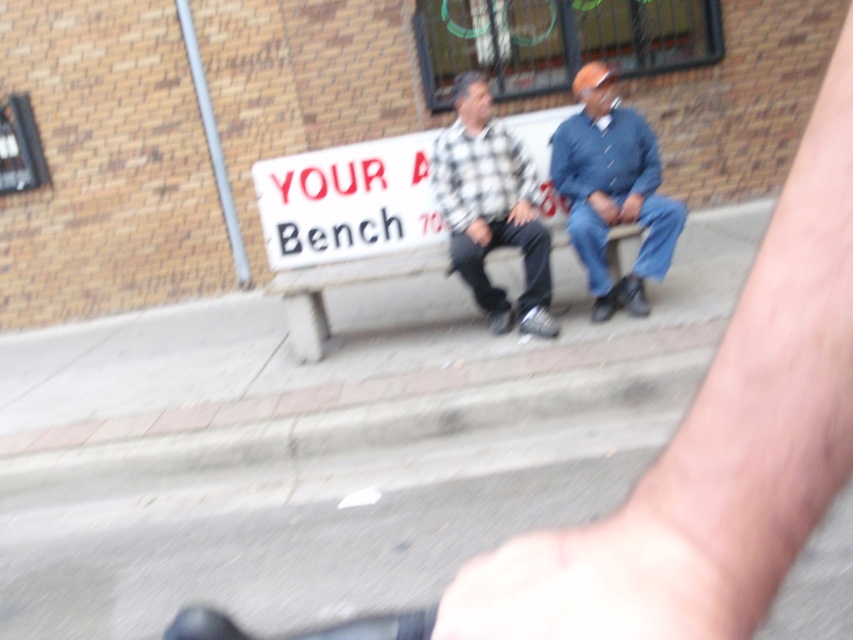
Question: Considering the relative positions of blue denim jeans at center and concrete bench at center in the image provided, where is blue denim jeans at center located with respect to concrete bench at center?

Choices:
 (A) below
 (B) above

Answer: (B)

Question: Estimate the real-world distances between objects in this image. Which object is farther from the blue denim jeans at center?

Choices:
 (A) white plastic sign at center
 (B) checkered fabric shirt at center
 (C) concrete bench at center

Answer: (A)

Question: Does white plastic sign at center have a larger size compared to checkered fabric shirt at center?

Choices:
 (A) yes
 (B) no

Answer: (B)

Question: Does checkered fabric shirt at center have a smaller size compared to concrete bench at center?

Choices:
 (A) no
 (B) yes

Answer: (B)

Question: Among these points, which one is nearest to the camera?

Choices:
 (A) (318, 244)
 (B) (625, 291)
 (C) (506, 136)
 (D) (407, 275)

Answer: (D)

Question: Which point is farther to the camera?

Choices:
 (A) (444, 157)
 (B) (631, 188)

Answer: (A)